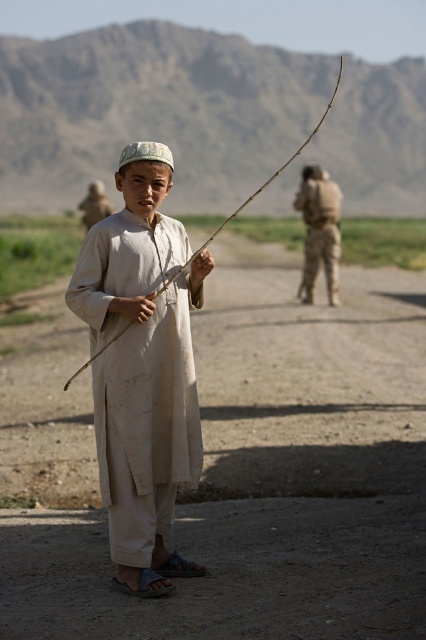
Is point (319, 241) positioned after point (190, 259)?

Yes.

Is point (328, 218) positioned in front of point (328, 104)?

No, it is not.

Identify the location of camouflage fabric uniform at right. The image size is (426, 640). (319, 230).

At what (x,y) coordinates should I click in order to perform the action: click on camouflage fabric uniform at right. Please return your answer as a coordinate pair (x, y). Looking at the image, I should click on (319, 230).

Measure the distance between dirt track at center and camera.

dirt track at center is 4.47 meters from camera.

Who is more forward, (356, 512) or (302, 182)?

Point (356, 512) is in front.

What do you see at coordinates (236, 467) in the screenshot? The image size is (426, 640). I see `dirt track at center` at bounding box center [236, 467].

Where is `dirt track at center`? The image size is (426, 640). dirt track at center is located at coordinates (236, 467).

What do you see at coordinates (141, 369) in the screenshot?
I see `beige cotton robe at center` at bounding box center [141, 369].

Which is in front, point (132, 588) or point (339, 74)?

Point (339, 74) is more forward.

At what (x,y) coordinates should I click in order to perform the action: click on beige cotton robe at center. Please return your answer as a coordinate pair (x, y). This screenshot has width=426, height=640. Looking at the image, I should click on (141, 369).